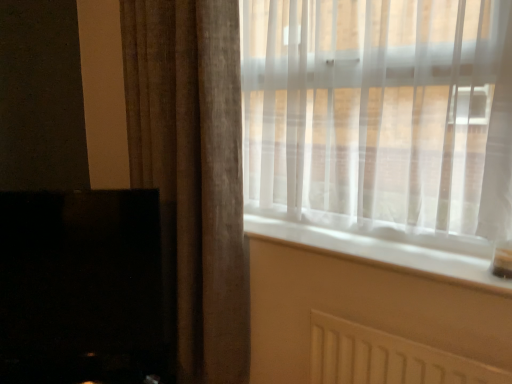
In order to click on vacant space underneath translucent fabric window at upper right (from a real-world perspective) in this screenshot , I will do `click(391, 243)`.